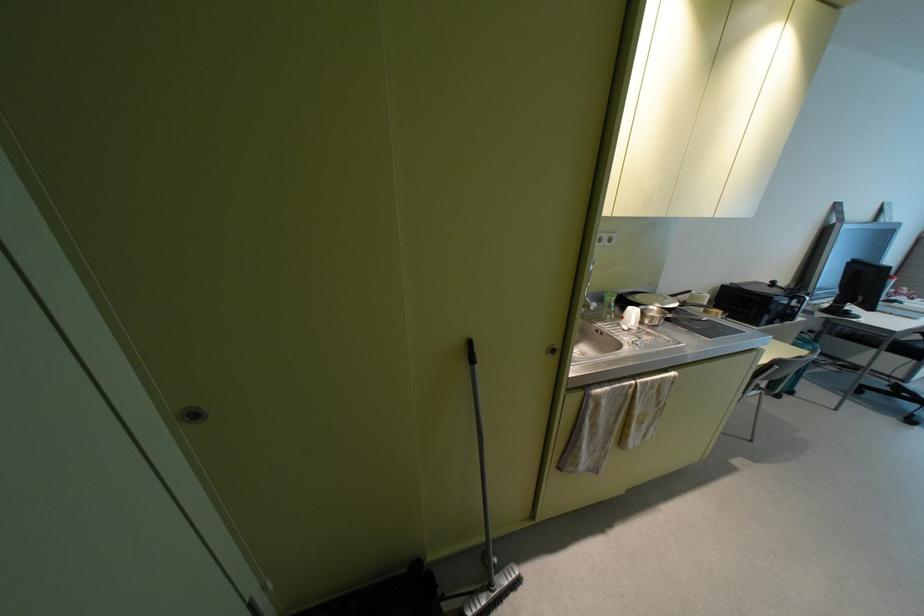
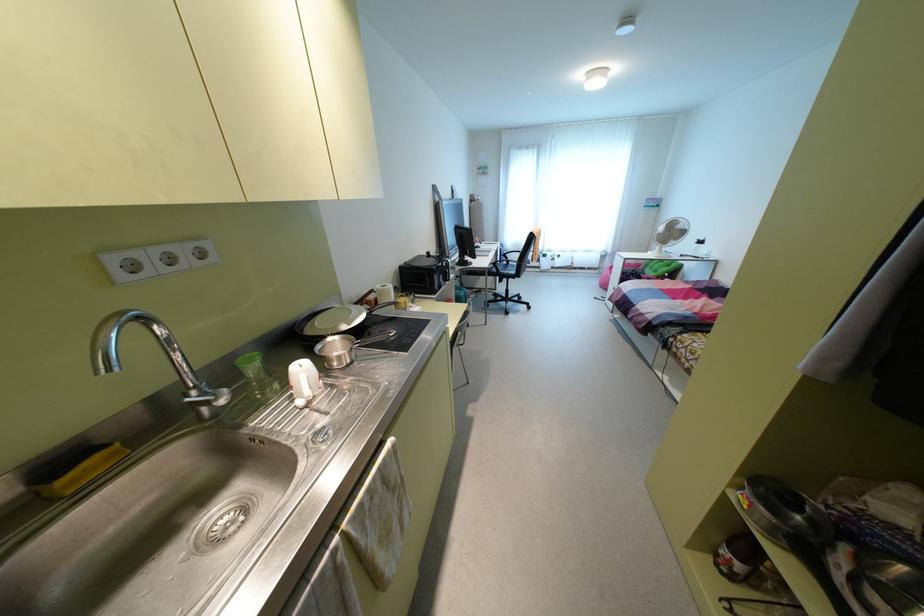
In the second image, find the point that corresponds to [611,299] in the first image.

(251, 366)